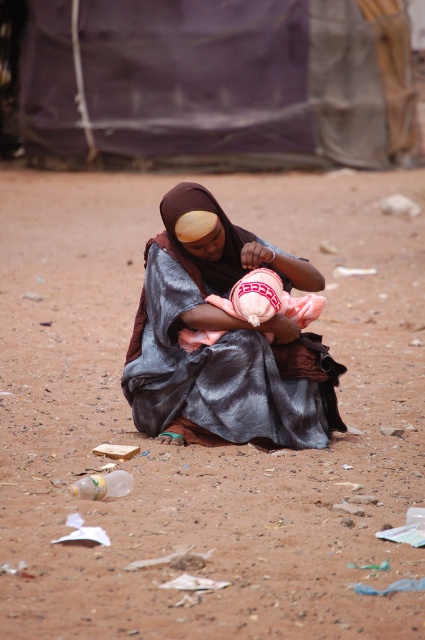
You are a drone operator trying to capture a closeup of the woman holding the baby. The drone is currently at point A, which is at coordinates point (139, 300). You need to move it to point B, located at point (263, 314). However, you must ensure that the drone doesn not fly over the woman to avoid disturbing her. Given the spatial relationship between these two points, can you safely move the drone from point A to point B without flying over her?

Point (139, 300) is behind point (263, 314), so moving the drone from point A to point B would not require flying over the woman. The drone can safely move from point A to point B without disturbing her.

You are a humanitarian aid worker in a refugee camp. You need to lay down a blanket for a mother and her baby. The blanket is 1.5 meters wide. Can the blanket cover both the brown sandy dirt at center and the silky brown dress at center without folding?

The brown sandy dirt at center is wider than the silky brown dress at center. Since the blanket is 1.5 meters wide, it depends on the actual width of the sandy dirt. If the sandy dirt is wider than 1.5 meters, the blanket won

What is located at the point with coordinates (x=197, y=444) in the image?

The point at coordinates (x=197, y=444) marks brown sandy dirt at center.